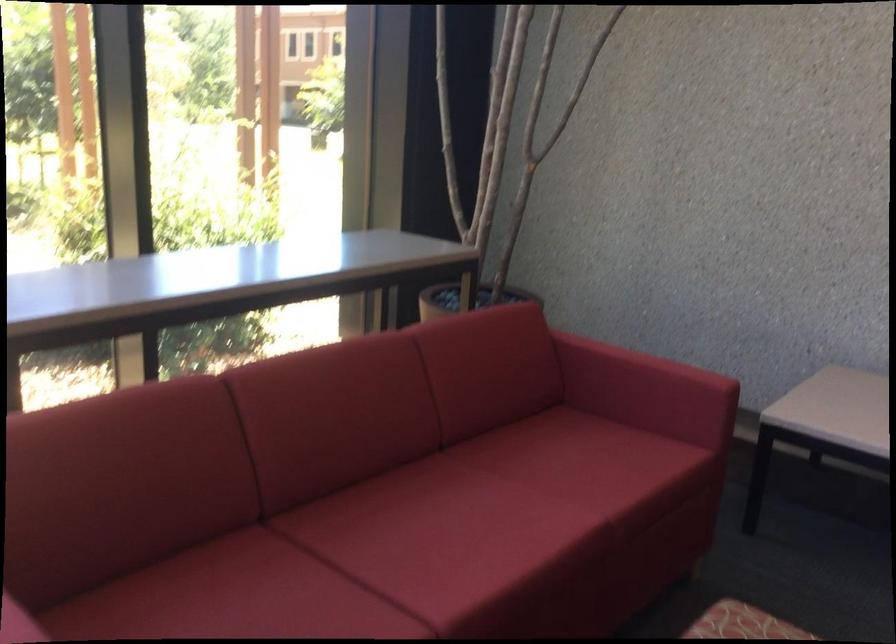
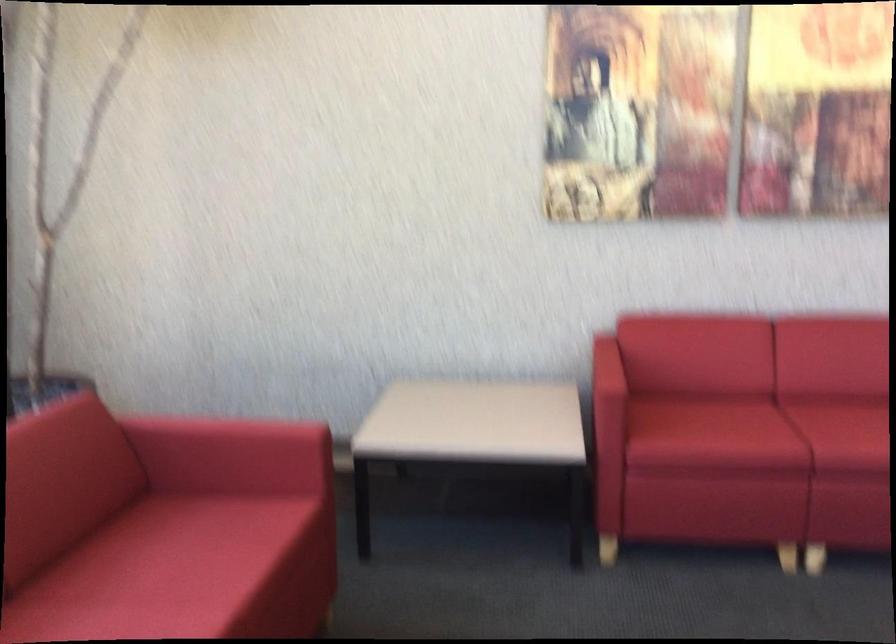
Question: The camera is either moving clockwise (left) or counter-clockwise (right) around the object. The first image is from the beginning of the video and the second image is from the end. Is the camera moving left or right when shooting the video?

Choices:
 (A) Left
 (B) Right

Answer: (A)